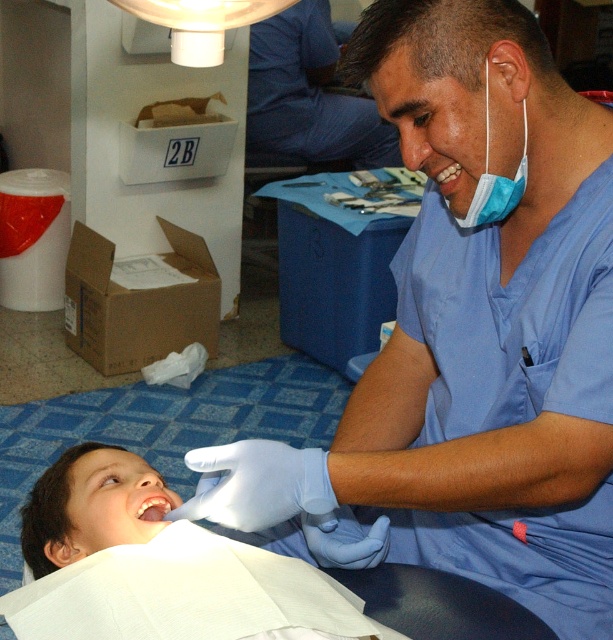
Locate an element on the screen. Image resolution: width=613 pixels, height=640 pixels. blue scrubs at upper right is located at coordinates (306, 97).

Looking at this image, who is more forward, (286, 129) or (492, 208)?

Point (492, 208) is in front.

At what (x,y) coordinates should I click in order to perform the action: click on blue scrubs at upper right. Please return your answer as a coordinate pair (x, y). The width and height of the screenshot is (613, 640). Looking at the image, I should click on (306, 97).

Is the position of blue surgical mask at upper right less distant than that of glossy white teeth at lower center?

That is True.

This screenshot has height=640, width=613. I want to click on blue surgical mask at upper right, so click(495, 180).

Who is more distant from viewer, (x=485, y=145) or (x=156, y=502)?

Point (x=156, y=502)

At what (x,y) coordinates should I click in order to perform the action: click on blue surgical mask at upper right. Please return your answer as a coordinate pair (x, y). Image resolution: width=613 pixels, height=640 pixels. Looking at the image, I should click on (495, 180).

Which is behind, point (132, 467) or point (280, 125)?

Point (280, 125)

Can you confirm if white cloth napkin at lower left is positioned to the right of blue scrubs at upper right?

Incorrect, white cloth napkin at lower left is not on the right side of blue scrubs at upper right.

Where is `white cloth napkin at lower left`? white cloth napkin at lower left is located at coordinates (91, 508).

Where is `white cloth napkin at lower left`? white cloth napkin at lower left is located at coordinates [x=91, y=508].